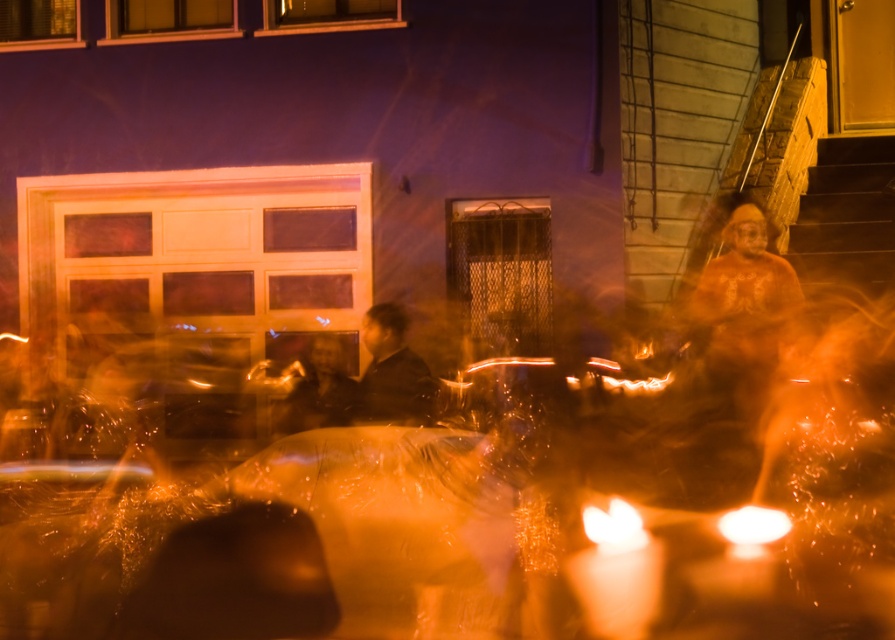
You are an interior designer planning to place a new decorative item in the scene. You have a choice between a tall decorative item and a shorter one. The scene has the matte bronze statue at right and the matte orange candle at lower right. Which object should you consider replacing if you want to maintain the current height balance between the two objects?

The matte bronze statue at right is taller than the matte orange candle at lower right. To maintain the height balance, you should consider replacing the shorter matte orange candle at lower right with a taller item or replace the taller matte bronze statue at right with a shorter one.